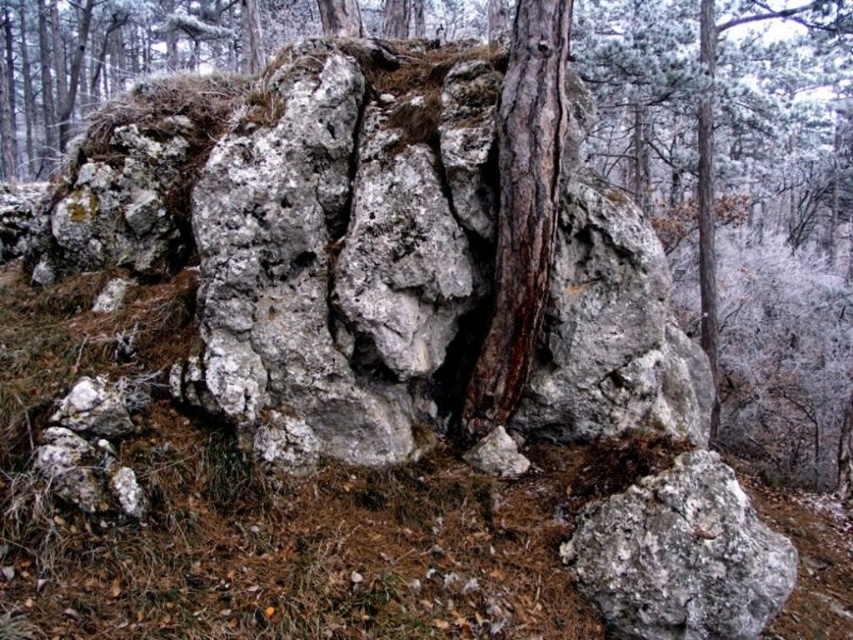
You are a GUI agent. You are given a task and a screenshot of the screen. Output one action in this format:
    pyautogui.click(x=<x>, y=<y>)
    Task: Click on the white lichen-covered rock at center
    
    Given the screenshot: What is the action you would take?
    pyautogui.click(x=346, y=248)

Can you confirm if white lichen-covered rock at center is positioned to the left of brown rough tree trunk at center?

Correct, you'll find white lichen-covered rock at center to the left of brown rough tree trunk at center.

Is point (241, 113) positioned behind point (503, 342)?

That is True.

At what (x,y) coordinates should I click in order to perform the action: click on white lichen-covered rock at center. Please return your answer as a coordinate pair (x, y). This screenshot has height=640, width=853. Looking at the image, I should click on (346, 248).

From the picture: Is white lichen-covered rock at center above gray rough rock at center?

Yes, white lichen-covered rock at center is above gray rough rock at center.

Is white lichen-covered rock at center positioned in front of gray rough rock at center?

No, it is behind gray rough rock at center.

Which is behind, point (403, 243) or point (672, 572)?

Positioned behind is point (403, 243).

This screenshot has width=853, height=640. I want to click on white lichen-covered rock at center, so click(x=346, y=248).

Is gray rough rock at center shorter than brown rough tree trunk at center?

Correct, gray rough rock at center is not as tall as brown rough tree trunk at center.

Find the location of a particular element. gray rough rock at center is located at coordinates (680, 556).